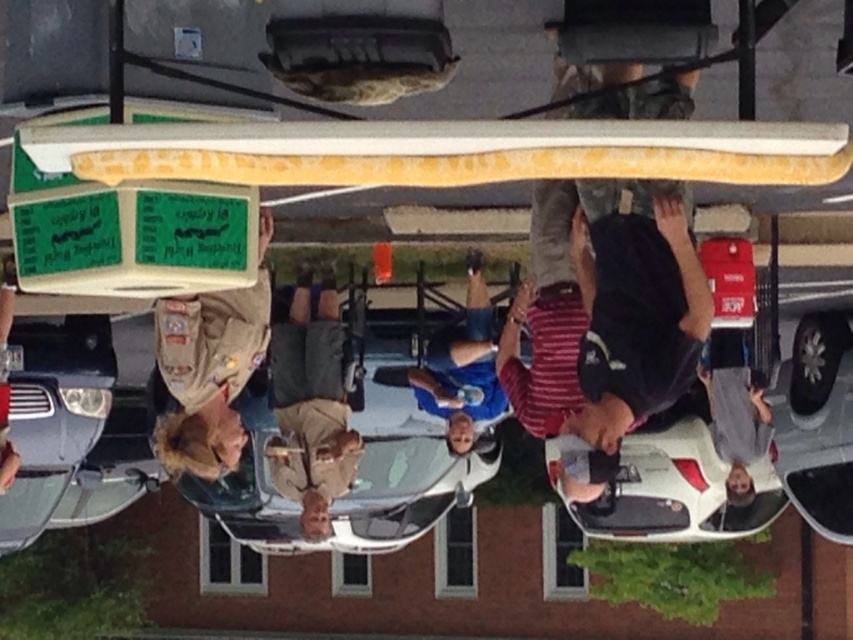
You are a photographer trying to capture a photo of the white glossy car at lower center and the blue denim jeans at center. Based on their sizes, which object should you focus on first to ensure it fits entirely within the frame?

The white glossy car at lower center is wider than the blue denim jeans at center, so you should focus on capturing the white glossy car at lower center first to ensure it fits entirely within the frame.

You are standing in the rotated image and want to approach the blue denim jeans at center. Which direction should you move relative to the white glossy car at lower center?

Since the white glossy car at lower center is closer to the viewer than the blue denim jeans at center, you should move away from the white glossy car at lower center to reach the blue denim jeans at center.

Based on the scene description, can you identify the object located at the coordinates point (352, 481)?

The metallic silver car at center is located at point (352, 481).